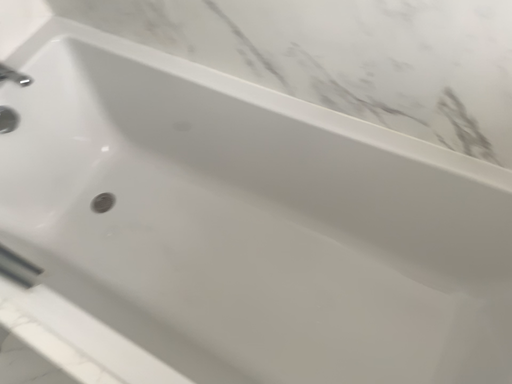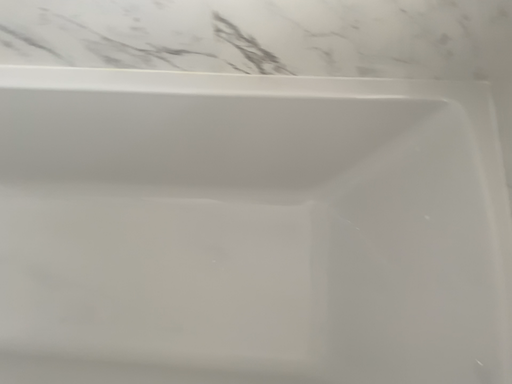
Question: Which way did the camera rotate in the video?

Choices:
 (A) rotated left
 (B) rotated right

Answer: (B)